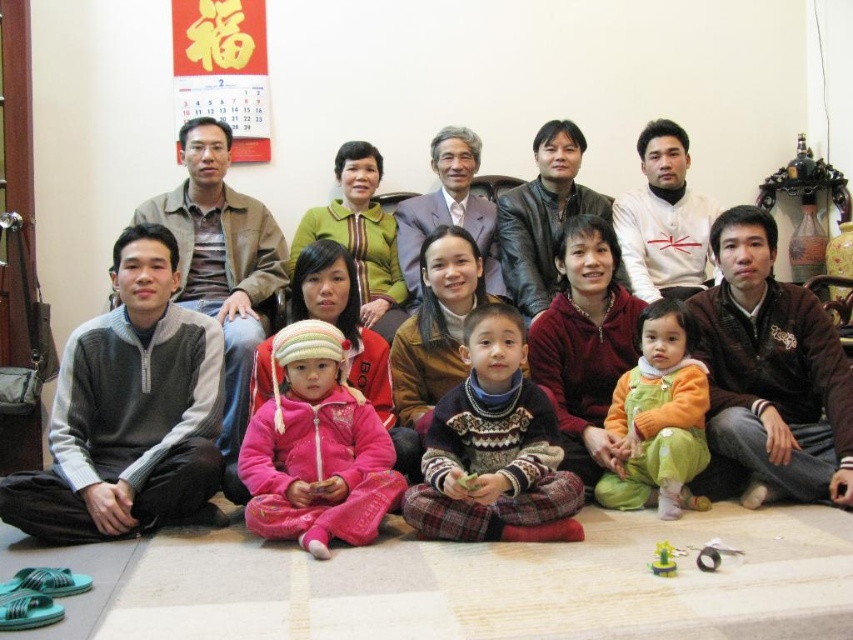
Question: Which point appears closest to the camera in this image?

Choices:
 (A) (238, 339)
 (B) (693, 422)
 (C) (263, 432)
 (D) (662, 554)

Answer: (D)

Question: Can you confirm if pink fleece jacket at center is bigger than knitted sweater at center?

Choices:
 (A) yes
 (B) no

Answer: (A)

Question: In this image, where is pink fleece jacket at lower left located relative to orange fleece onesie at lower center?

Choices:
 (A) above
 (B) below

Answer: (B)

Question: Among these points, which one is nearest to the camera?

Choices:
 (A) (514, 355)
 (B) (241, 461)
 (C) (735, 552)
 (D) (656, 554)

Answer: (D)

Question: Can you confirm if knitted sweater at center is smaller than pink fleece jacket at lower left?

Choices:
 (A) no
 (B) yes

Answer: (B)

Question: Among these points, which one is nearest to the camera?

Choices:
 (A) click(x=659, y=568)
 (B) click(x=654, y=326)
 (C) click(x=717, y=561)
 (D) click(x=514, y=372)

Answer: (A)